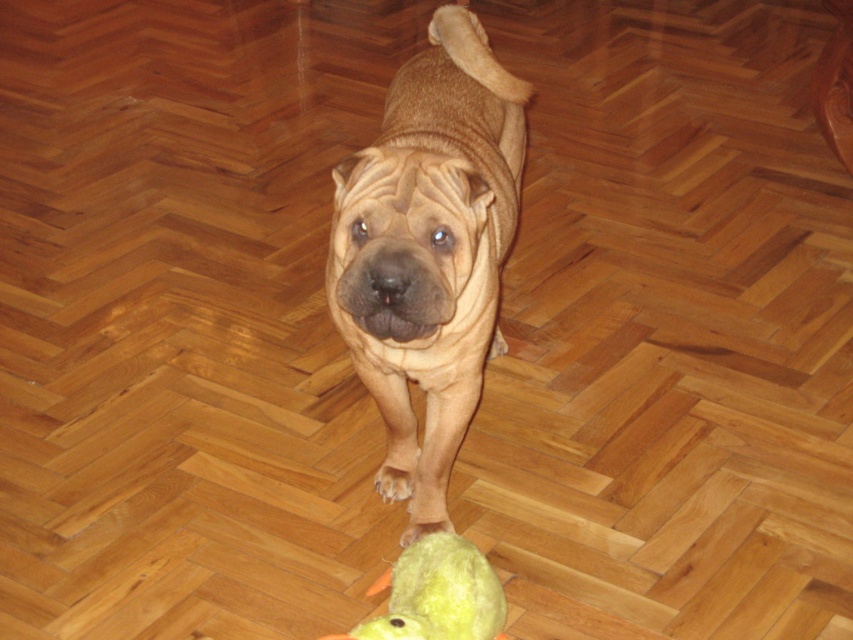
Between point (483, 189) and point (445, 518), which one is positioned in front?

Positioned in front is point (483, 189).

Which is more to the left, brown matte dog at center or yellow soft toy at lower center?

From the viewer's perspective, brown matte dog at center appears more on the left side.

Measure the distance between brown matte dog at center and camera.

brown matte dog at center and camera are 4.16 feet apart.

At what (x,y) coordinates should I click in order to perform the action: click on brown matte dog at center. Please return your answer as a coordinate pair (x, y). The width and height of the screenshot is (853, 640). Looking at the image, I should click on (428, 248).

Who is higher up, brown matte dog at center or yellow plush duck at lower center?

brown matte dog at center is above.

Who is shorter, brown matte dog at center or yellow plush duck at lower center?

yellow plush duck at lower center is shorter.

You are a GUI agent. You are given a task and a screenshot of the screen. Output one action in this format:
    pyautogui.click(x=<x>, y=<y>)
    Task: Click on the brown matte dog at center
    
    Given the screenshot: What is the action you would take?
    pyautogui.click(x=428, y=248)

Where is `brown matte dog at center`? The height and width of the screenshot is (640, 853). brown matte dog at center is located at coordinates (428, 248).

Can you confirm if yellow plush duck at lower center is bigger than yellow soft toy at lower center?

Correct, yellow plush duck at lower center is larger in size than yellow soft toy at lower center.

Does yellow plush duck at lower center appear under yellow soft toy at lower center?

Indeed, yellow plush duck at lower center is positioned under yellow soft toy at lower center.

You are a GUI agent. You are given a task and a screenshot of the screen. Output one action in this format:
    pyautogui.click(x=<x>, y=<y>)
    Task: Click on the yellow plush duck at lower center
    
    Given the screenshot: What is the action you would take?
    pyautogui.click(x=436, y=595)

The height and width of the screenshot is (640, 853). I want to click on yellow plush duck at lower center, so click(x=436, y=595).